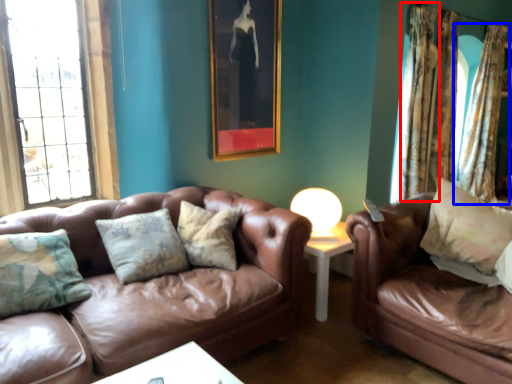
Question: Which object is further to the camera taking this photo, curtain (highlighted by a red box) or curtain (highlighted by a blue box)?

Choices:
 (A) curtain
 (B) curtain

Answer: (B)